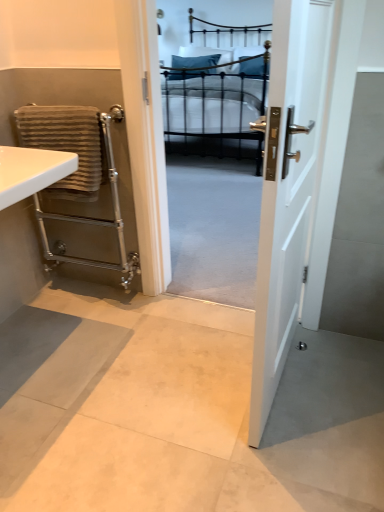
Question: From a real-world perspective, does white glossy sink at left sit lower than blue fabric pillow at center?

Choices:
 (A) yes
 (B) no

Answer: (A)

Question: Can you confirm if white glossy sink at left is shorter than blue fabric pillow at center?

Choices:
 (A) no
 (B) yes

Answer: (B)

Question: Considering the relative sizes of white glossy sink at left and blue fabric pillow at center in the image provided, is white glossy sink at left thinner than blue fabric pillow at center?

Choices:
 (A) yes
 (B) no

Answer: (B)

Question: Is blue fabric pillow at center located within white glossy sink at left?

Choices:
 (A) no
 (B) yes

Answer: (A)

Question: Is white glossy sink at left with blue fabric pillow at center?

Choices:
 (A) yes
 (B) no

Answer: (B)

Question: Is white glossy sink at left at the left side of blue fabric pillow at center?

Choices:
 (A) yes
 (B) no

Answer: (A)

Question: Is brown striped towel at left closer to the viewer compared to blue fabric pillow at center?

Choices:
 (A) no
 (B) yes

Answer: (B)

Question: Considering the relative sizes of brown striped towel at left and blue fabric pillow at center in the image provided, is brown striped towel at left bigger than blue fabric pillow at center?

Choices:
 (A) yes
 (B) no

Answer: (B)

Question: Can you confirm if brown striped towel at left is thinner than blue fabric pillow at center?

Choices:
 (A) yes
 (B) no

Answer: (A)

Question: From the image's perspective, is brown striped towel at left on top of blue fabric pillow at center?

Choices:
 (A) no
 (B) yes

Answer: (A)

Question: Is brown striped towel at left in contact with blue fabric pillow at center?

Choices:
 (A) no
 (B) yes

Answer: (A)

Question: Is brown striped towel at left located outside blue fabric pillow at center?

Choices:
 (A) no
 (B) yes

Answer: (B)

Question: Is brown striped towel at left closer to the viewer compared to black metal bed at center?

Choices:
 (A) yes
 (B) no

Answer: (A)